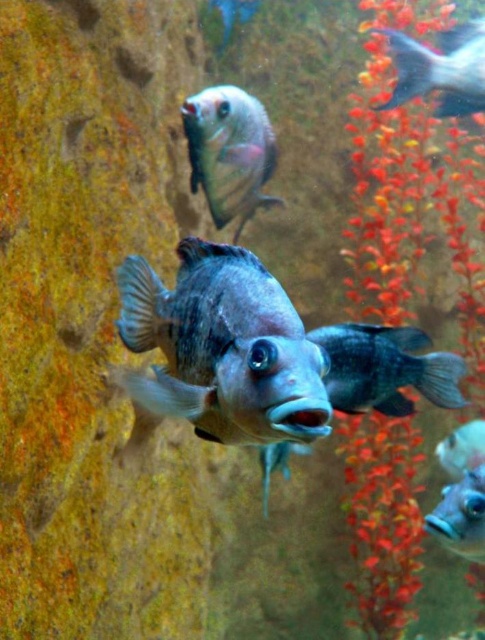
Question: Is satin silver fish at lower right positioned before shiny silver fish at upper center?

Choices:
 (A) yes
 (B) no

Answer: (A)

Question: Which object appears closest to the camera in this image?

Choices:
 (A) shiny silver fish at upper center
 (B) shiny blue fish at lower right
 (C) shiny silver fish at upper right
 (D) shiny blue fish at center

Answer: (D)

Question: Which point is farther to the camera?

Choices:
 (A) shiny blue fish at center
 (B) satin silver fish at upper center
 (C) blue glossy fish at center

Answer: (B)

Question: Is satin silver fish at upper center below shiny silver fish at upper center?

Choices:
 (A) no
 (B) yes

Answer: (B)

Question: Can you confirm if shiny silver fish at upper right is positioned to the right of shiny silver fish at upper center?

Choices:
 (A) no
 (B) yes

Answer: (B)

Question: Which object is the farthest from the shiny silver fish at upper right?

Choices:
 (A) shiny blue fish at lower right
 (B) blue glossy fish at center
 (C) shiny blue fish at center

Answer: (C)